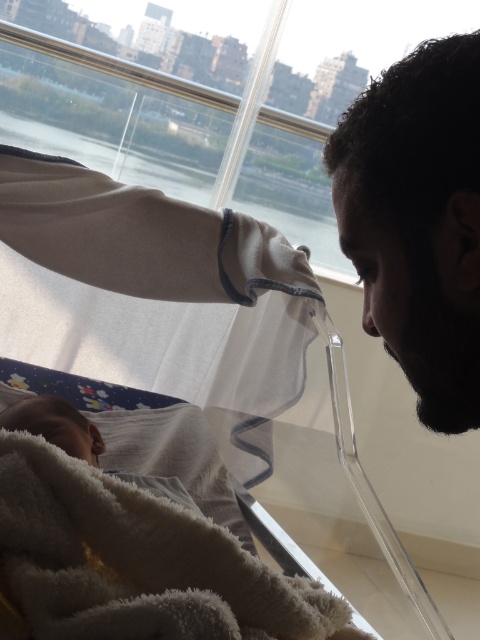
Question: Is dark brown hair at upper right to the right of white fluffy blanket at lower left from the viewer's perspective?

Choices:
 (A) yes
 (B) no

Answer: (A)

Question: Can you confirm if dark brown hair at upper right is bigger than white fluffy blanket at lower left?

Choices:
 (A) yes
 (B) no

Answer: (B)

Question: In this image, where is dark brown hair at upper right located relative to white fluffy blanket at lower left?

Choices:
 (A) above
 (B) below

Answer: (A)

Question: Which object is farther from the camera taking this photo?

Choices:
 (A) white fluffy blanket at lower left
 (B) dark brown hair at upper right

Answer: (A)

Question: Which point is closer to the camera?

Choices:
 (A) white fluffy blanket at lower left
 (B) dark brown hair at upper right

Answer: (B)